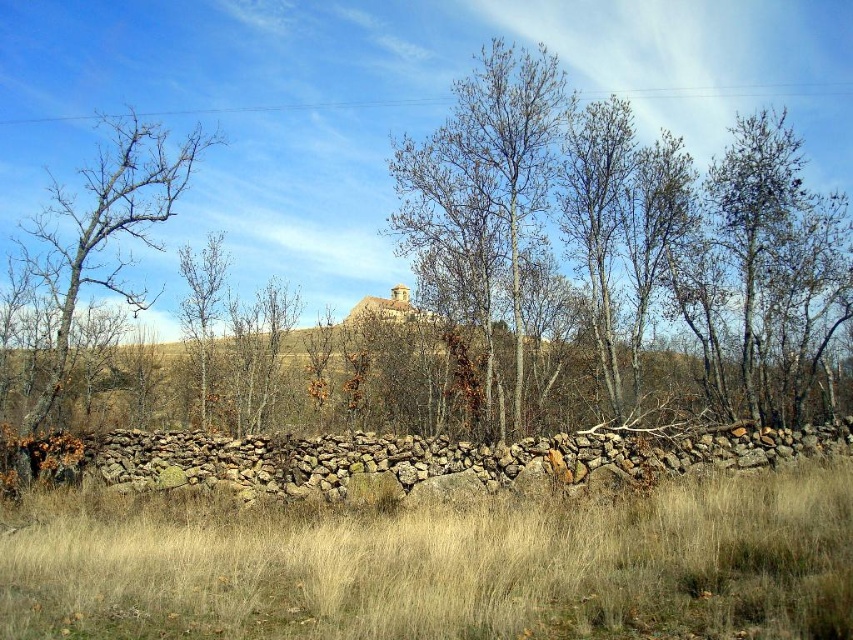
Does dry grass at lower center appear on the left side of bare wood tree at left?

In fact, dry grass at lower center is to the right of bare wood tree at left.

Is point (177, 513) more distant than point (184, 163)?

No, (177, 513) is closer to viewer.

Where is `dry grass at lower center`? The height and width of the screenshot is (640, 853). dry grass at lower center is located at coordinates (445, 566).

Is point (206, 588) farther from viewer compared to point (444, 253)?

No.

How much distance is there between dry grass at lower center and bare wood tree at center?

dry grass at lower center and bare wood tree at center are 8.09 meters apart from each other.

In order to click on dry grass at lower center in this screenshot , I will do pos(445,566).

What are the coordinates of `dry grass at lower center` in the screenshot? It's located at (445, 566).

Is bare wood tree at left to the right of brown bark tree at left from the viewer's perspective?

Incorrect, bare wood tree at left is not on the right side of brown bark tree at left.

Which is above, bare wood tree at left or brown bark tree at left?

bare wood tree at left is higher up.

Where is `bare wood tree at left`? bare wood tree at left is located at coordinates (105, 227).

Locate an element on the screen. bare wood tree at left is located at coordinates (105, 227).